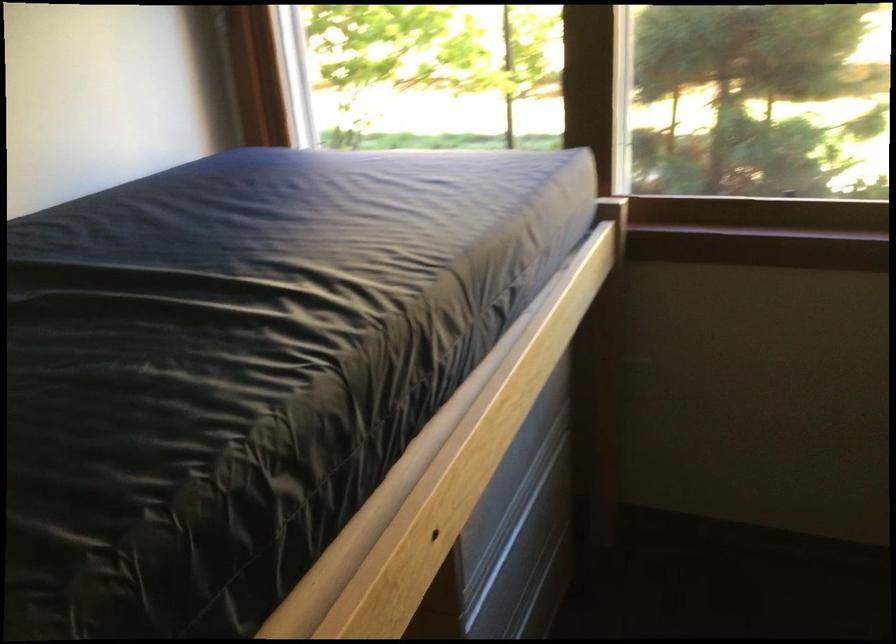
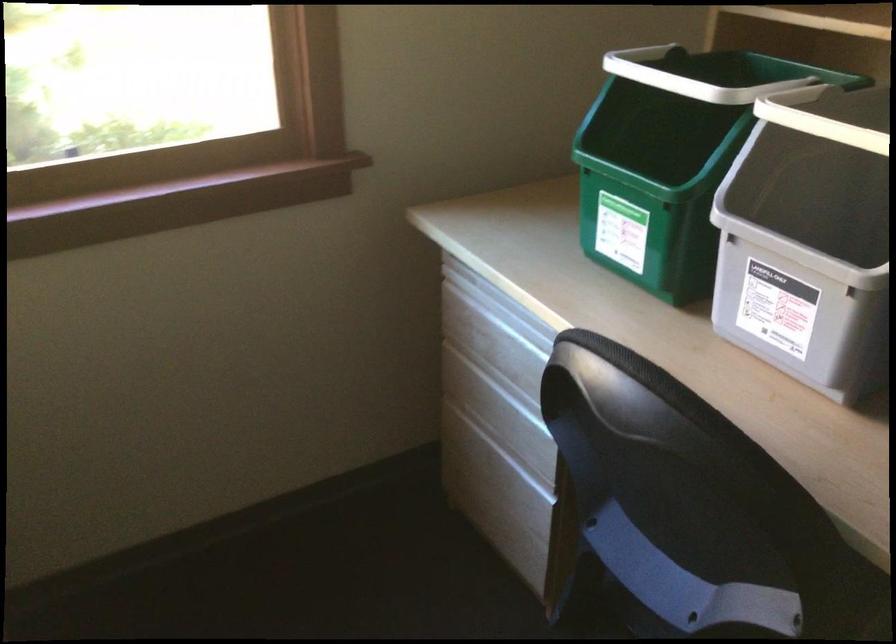
Question: How did the camera likely rotate?

Choices:
 (A) Left
 (B) Right
 (C) Up
 (D) Down

Answer: (B)